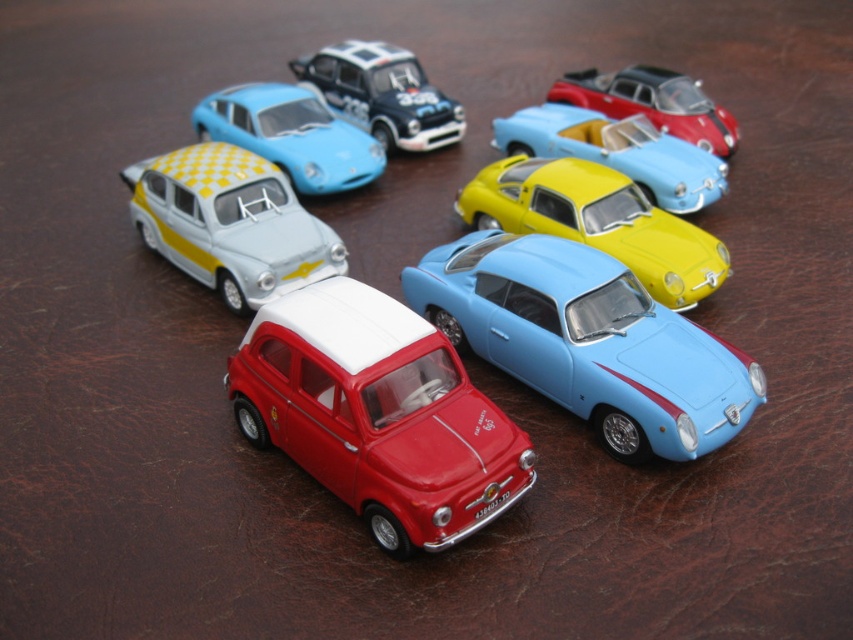
Question: Can you confirm if shiny red car at center is thinner than shiny red car at upper right?

Choices:
 (A) yes
 (B) no

Answer: (B)

Question: Which is farther from the shiny red car at center?

Choices:
 (A) light blue glossy car at center
 (B) shiny red car at upper right

Answer: (B)

Question: Can you confirm if shiny red car at center is thinner than yellow checkered fabric car at upper left?

Choices:
 (A) yes
 (B) no

Answer: (B)

Question: Which point is closer to the camera?

Choices:
 (A) (374, 308)
 (B) (236, 122)
 (C) (440, 92)
 (D) (273, 230)

Answer: (A)

Question: Among these points, which one is nearest to the camera?

Choices:
 (A) (550, 275)
 (B) (277, 186)
 (C) (252, 115)

Answer: (A)

Question: Does yellow checkered fabric car at upper left have a lesser width compared to shiny red car at upper right?

Choices:
 (A) yes
 (B) no

Answer: (B)